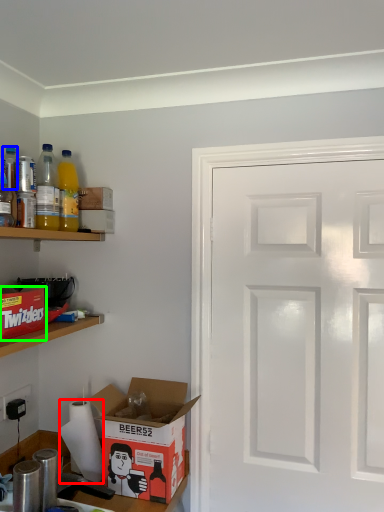
Question: Which is nearer to the paper towel (highlighted by a red box)? bottle (highlighted by a blue box) or cardboard box (highlighted by a green box).

Choices:
 (A) bottle
 (B) cardboard box

Answer: (B)